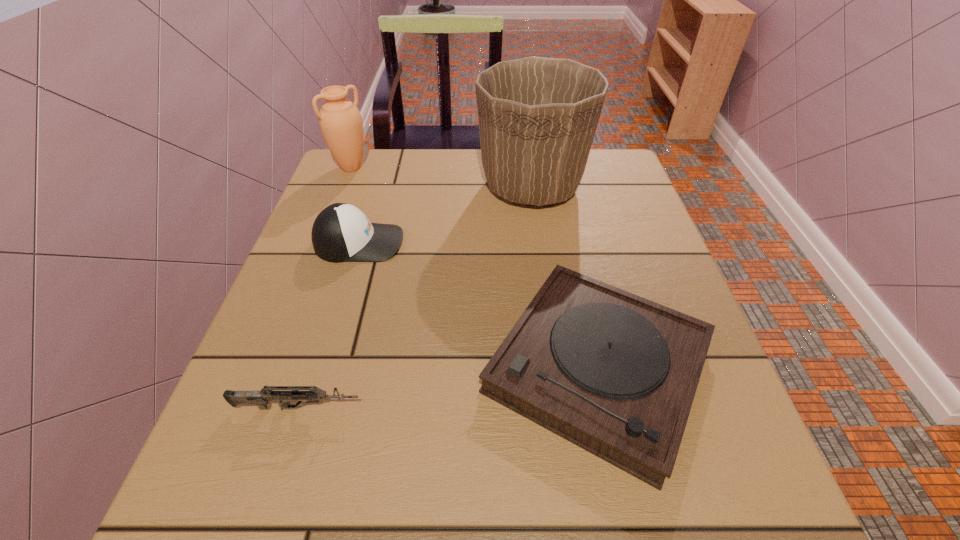
At what (x,y) coordinates should I click in order to perform the action: click on object that is at the far right corner. Please return your answer as a coordinate pair (x, y). This screenshot has width=960, height=540. Looking at the image, I should click on (537, 116).

Image resolution: width=960 pixels, height=540 pixels. Find the location of `object at the near right corner`. object at the near right corner is located at coordinates (616, 374).

What are the coordinates of `vacant space at the far edge of the desktop` in the screenshot? It's located at (429, 176).

The width and height of the screenshot is (960, 540). I want to click on free space at the near edge, so click(370, 492).

Find the location of a particular element. Image resolution: width=960 pixels, height=540 pixels. free spot at the left edge of the desktop is located at coordinates (327, 204).

The image size is (960, 540). What are the coordinates of `vacant area at the right edge of the desktop` in the screenshot? It's located at (618, 218).

The image size is (960, 540). In the image, there is a desktop. Find the location of `vacant space at the far left corner`. vacant space at the far left corner is located at coordinates (365, 148).

At what (x,y) coordinates should I click in order to perform the action: click on vacant area at the near right corner of the desktop. Please return your answer as a coordinate pair (x, y). This screenshot has height=540, width=960. Looking at the image, I should click on (685, 507).

This screenshot has height=540, width=960. What are the coordinates of `free space between the third farthest object and the tallest object` in the screenshot? It's located at (445, 214).

Find the location of a particular element. unoccupied area between the gun and the third nearest object is located at coordinates (328, 325).